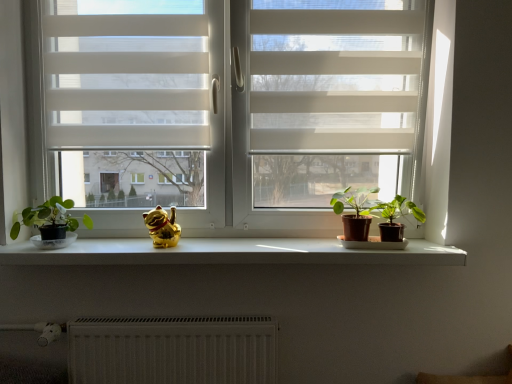
What do you see at coordinates (394, 217) in the screenshot?
I see `green matte houseplant at right, acting as the 1th houseplant starting from the right` at bounding box center [394, 217].

How much space does green matte plant at center, placed as the 2th houseplant when sorted from right to left, occupy vertically?

The height of green matte plant at center, placed as the 2th houseplant when sorted from right to left, is 7.11 inches.

Identify the location of gold shiny cat at center. This screenshot has width=512, height=384. (162, 227).

You are a GUI agent. You are given a task and a screenshot of the screen. Output one action in this format:
    pyautogui.click(x=<x>, y=<y>)
    Task: Click on the white smooth window sill at center
    
    Given the screenshot: What is the action you would take?
    pyautogui.click(x=229, y=253)

Describe the element at coordinates (128, 100) in the screenshot. I see `white sheer blinds at upper left` at that location.

You are a GUI agent. You are given a task and a screenshot of the screen. Output one action in this format:
    pyautogui.click(x=<x>, y=<y>)
    Task: Click on the green matte houseplant at right, acting as the 1th houseplant starting from the right
    This screenshot has height=384, width=512.
    Given the screenshot: What is the action you would take?
    pyautogui.click(x=394, y=217)

From the picture: Are white smooth window sill at center and white matte screen door at upper center making contact?

No, white smooth window sill at center is not next to white matte screen door at upper center.

Is white smooth window sill at center not within white matte screen door at upper center?

Absolutely, white smooth window sill at center is external to white matte screen door at upper center.

In terms of width, does white smooth window sill at center look wider or thinner when compared to white matte screen door at upper center?

Considering their sizes, white smooth window sill at center looks broader than white matte screen door at upper center.

From their relative heights in the image, would you say white smooth window sill at center is taller or shorter than white matte screen door at upper center?

Considering their sizes, white smooth window sill at center has less height than white matte screen door at upper center.

Is white textured radiator at lower center at the back of gold shiny cat at center?

No, gold shiny cat at center's orientation is not away from white textured radiator at lower center.

How different are the orientations of gold shiny cat at center and white textured radiator at lower center in degrees?

There is a 1.59-degree angle between the facing directions of gold shiny cat at center and white textured radiator at lower center.

Considering the relative sizes of gold shiny cat at center and white textured radiator at lower center in the image provided, is gold shiny cat at center wider than white textured radiator at lower center?

Yes.

Is there a large distance between gold shiny cat at center and white textured radiator at lower center?

No, gold shiny cat at center is not far away from white textured radiator at lower center.

Which of these two, white textured radiator at lower center or white smooth window sill at center, stands shorter?

white smooth window sill at center.

From a real-world perspective, is white textured radiator at lower center over white smooth window sill at center?

Actually, white textured radiator at lower center is physically below white smooth window sill at center in the real world.

Which is in front, white textured radiator at lower center or white smooth window sill at center?

white smooth window sill at center is more forward.

Identify the location of window that appears on the right of white sheer blinds at upper left. (230, 104).

Looking at their sizes, would you say white sheer blinds at upper left is wider or thinner than white matte window at center?

In the image, white sheer blinds at upper left appears to be more narrow than white matte window at center.

Does point (114, 67) come farther from viewer compared to point (207, 206)?

That is False.

Could white matte window at center be considered to be inside white sheer blinds at upper left?

Actually, white matte window at center is outside white sheer blinds at upper left.

From the image's perspective, does white smooth window sill at center appear higher than green matte plant at center, placed as the 2th houseplant when sorted from right to left?

No.

Is white smooth window sill at center wider or thinner than green matte plant at center, placed as the 2th houseplant when sorted from right to left?

Clearly, white smooth window sill at center has more width compared to green matte plant at center, placed as the 2th houseplant when sorted from right to left.

Can you confirm if white smooth window sill at center is smaller than green matte plant at center, which is counted as the second houseplant, starting from the left?

Actually, white smooth window sill at center might be larger than green matte plant at center, which is counted as the second houseplant, starting from the left.

From a real-world perspective, is green matte plant at left, the 3th houseplant when ordered from right to left, beneath green matte houseplant at right, the third houseplant when ordered from left to right?

Correct, in the physical world, green matte plant at left, the 3th houseplant when ordered from right to left, is lower than green matte houseplant at right, the third houseplant when ordered from left to right.

From the image's perspective, which one is positioned lower, green matte plant at left, the 3th houseplant when ordered from right to left, or green matte houseplant at right, the third houseplant when ordered from left to right?

green matte plant at left, the 3th houseplant when ordered from right to left, is shown below in the image.

Considering the positions of objects green matte plant at left, the 3th houseplant when ordered from right to left, and green matte houseplant at right, acting as the 1th houseplant starting from the right, in the image provided, who is in front, green matte plant at left, the 3th houseplant when ordered from right to left, or green matte houseplant at right, acting as the 1th houseplant starting from the right,?

green matte plant at left, the 3th houseplant when ordered from right to left, is in front.

Does point (48, 237) come behind point (62, 176)?

No, it is not.

Does green matte plant at left, the 3th houseplant when ordered from right to left, touch white sheer blinds at upper left?

No, green matte plant at left, the 3th houseplant when ordered from right to left, is not making contact with white sheer blinds at upper left.

This screenshot has width=512, height=384. I want to click on window screen on the right side of green matte plant at left, the first houseplant viewed from the left, so click(128, 100).

This screenshot has width=512, height=384. I want to click on window sill to the left of white matte screen door at upper center, so click(x=229, y=253).

There is a white textured radiator at lower center. Identify the location of animal above it (from a real-world perspective). (162, 227).

Based on their spatial positions, is gold shiny cat at center or white textured radiator at lower center further from green matte houseplant at right, the third houseplant when ordered from left to right?

white textured radiator at lower center is further to green matte houseplant at right, the third houseplant when ordered from left to right.

Looking at this image, estimate the real-world distances between objects in this image. Which object is further from green matte plant at center, which is counted as the second houseplant, starting from the left, white matte window at center or white sheer blinds at upper left?

white sheer blinds at upper left is further to green matte plant at center, which is counted as the second houseplant, starting from the left.

Based on their spatial positions, is green matte plant at center, placed as the 2th houseplant when sorted from right to left, or gold shiny cat at center closer to green matte plant at left, the 3th houseplant when ordered from right to left?

Among the two, gold shiny cat at center is located nearer to green matte plant at left, the 3th houseplant when ordered from right to left.

Looking at the image, which one is located closer to green matte houseplant at right, the third houseplant when ordered from left to right, white smooth window sill at center or green matte plant at left, the first houseplant viewed from the left?

The object closer to green matte houseplant at right, the third houseplant when ordered from left to right, is white smooth window sill at center.

When comparing their distances from white matte screen door at upper center, does white smooth window sill at center or white matte window at center seem further?

white smooth window sill at center.

Considering their positions, is green matte plant at left, the first houseplant viewed from the left, positioned closer to white matte screen door at upper center than white smooth window sill at center?

white smooth window sill at center lies closer to white matte screen door at upper center than the other object.

Looking at the image, which one is located further to white textured radiator at lower center, green matte houseplant at right, acting as the 1th houseplant starting from the right, or green matte plant at left, the first houseplant viewed from the left?

green matte houseplant at right, acting as the 1th houseplant starting from the right, is further to white textured radiator at lower center.

When comparing their distances from green matte plant at left, the 3th houseplant when ordered from right to left, does white matte window at center or gold shiny cat at center seem further?

The object further to green matte plant at left, the 3th houseplant when ordered from right to left, is white matte window at center.

I want to click on window between green matte plant at left, the 3th houseplant when ordered from right to left, and green matte plant at center, placed as the 2th houseplant when sorted from right to left, in the horizontal direction, so click(x=230, y=104).

Locate an element on the screen. window sill that lies between white matte screen door at upper center and white textured radiator at lower center from top to bottom is located at coordinates (229, 253).

Image resolution: width=512 pixels, height=384 pixels. I want to click on radiator between green matte plant at left, the first houseplant viewed from the left, and green matte houseplant at right, the third houseplant when ordered from left to right, in the horizontal direction, so click(173, 350).

At what (x,y) coordinates should I click in order to perform the action: click on houseplant between white smooth window sill at center and green matte houseplant at right, the third houseplant when ordered from left to right. Please return your answer as a coordinate pair (x, y). Looking at the image, I should click on (355, 212).